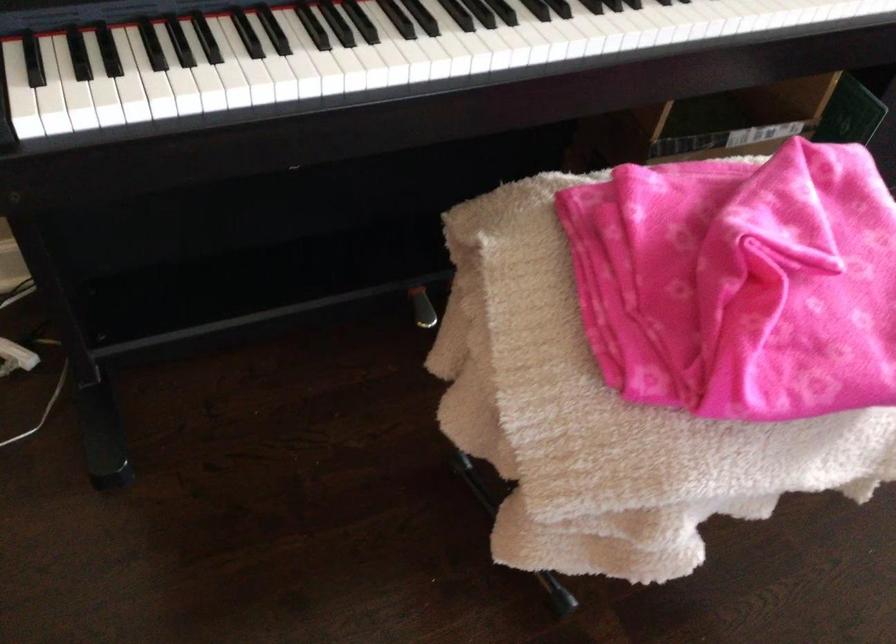
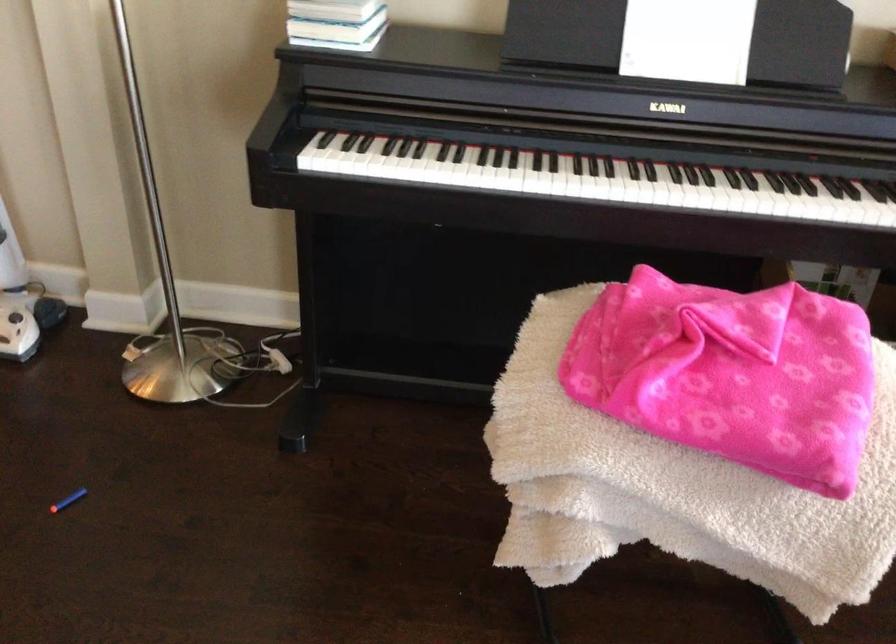
Question: The camera is either moving clockwise (left) or counter-clockwise (right) around the object. The first image is from the beginning of the video and the second image is from the end. Is the camera moving left or right when shooting the video?

Choices:
 (A) Left
 (B) Right

Answer: (B)